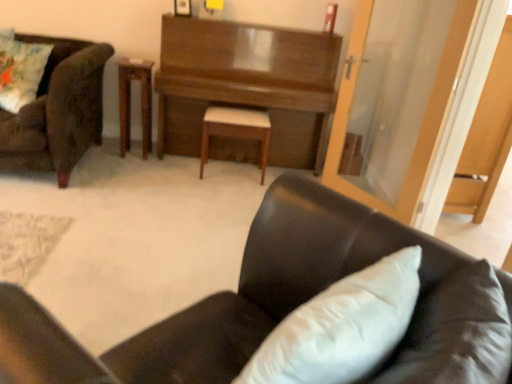
Image resolution: width=512 pixels, height=384 pixels. Describe the element at coordinates (58, 110) in the screenshot. I see `velvet brown armchair at left, the 1th chair viewed from the top` at that location.

I want to click on shiny brown piano at center, so click(247, 84).

Image resolution: width=512 pixels, height=384 pixels. I want to click on white leather stool at center, so click(236, 130).

What do you see at coordinates (130, 101) in the screenshot? Image resolution: width=512 pixels, height=384 pixels. I see `wooden table at center` at bounding box center [130, 101].

This screenshot has height=384, width=512. Describe the element at coordinates (276, 284) in the screenshot. I see `black leather chair at lower right, the second chair in the back-to-front sequence` at that location.

What do you see at coordinates (486, 138) in the screenshot?
I see `transparent glass door at right` at bounding box center [486, 138].

What is the approximate height of transparent glass door at right?

transparent glass door at right is 4.69 feet in height.

Identify the location of velvet brown armchair at left, which is the 1th chair in back-to-front order. (58, 110).

Does white leather stool at center have a greater height compared to shiny brown piano at center?

Incorrect, the height of white leather stool at center is not larger of that of shiny brown piano at center.

Is white leather stool at center looking in the opposite direction of shiny brown piano at center?

Absolutely, white leather stool at center is directed away from shiny brown piano at center.

Is white leather stool at center wider than shiny brown piano at center?

No.

Which object is wider, white leather stool at center or black leather chair at lower right, the second chair when ordered from left to right?

Wider between the two is black leather chair at lower right, the second chair when ordered from left to right.

Is white leather stool at center to the left or to the right of black leather chair at lower right, positioned as the 1th chair in front-to-back order, in the image?

white leather stool at center is positioned on black leather chair at lower right, positioned as the 1th chair in front-to-back order,'s left side.

Considering the points (265, 158) and (42, 363), which point is in front, point (265, 158) or point (42, 363)?

The point (42, 363) is in front.

Is black leather chair at lower right, the 1th chair positioned from the right, at the back of white leather stool at center?

white leather stool at center does not have its back to black leather chair at lower right, the 1th chair positioned from the right.

Looking at this image, is transparent glass door at right smaller than black leather chair at lower right, the 1th chair positioned from the right?

Correct, transparent glass door at right occupies less space than black leather chair at lower right, the 1th chair positioned from the right.

Between point (486, 146) and point (168, 322), which one is positioned behind?

The point (486, 146) is farther.

Which object is thinner, transparent glass door at right or black leather chair at lower right, the second chair viewed from the top?

transparent glass door at right.

From the image's perspective, is transparent glass door at right on top of black leather chair at lower right, the second chair viewed from the top?

Indeed, from the image's perspective, transparent glass door at right is shown above black leather chair at lower right, the second chair viewed from the top.

In the scene shown: Which object is closer to the camera, shiny brown piano at center or white leather stool at center?

shiny brown piano at center is closer to the camera.

Is white leather stool at center a part of shiny brown piano at center?

Indeed, white leather stool at center is located within shiny brown piano at center.

Could you tell me if shiny brown piano at center is facing white leather stool at center?

Yes, shiny brown piano at center is turned towards white leather stool at center.

Looking at this image, is the surface of shiny brown piano at center in direct contact with floral fabric pillow at upper left?

No.

From their relative heights in the image, would you say shiny brown piano at center is taller or shorter than floral fabric pillow at upper left?

shiny brown piano at center is taller than floral fabric pillow at upper left.

Is shiny brown piano at center situated inside floral fabric pillow at upper left or outside?

The correct answer is: outside.

From a real-world perspective, relative to transparent glass door at right, is transparent glass door at upper right vertically above or below?

transparent glass door at upper right is above transparent glass door at right.

What's the angular difference between transparent glass door at upper right and transparent glass door at right's facing directions?

148 degrees.

Consider the image. From the image's perspective, is transparent glass door at upper right beneath transparent glass door at right?

Indeed, from the image's perspective, transparent glass door at upper right is shown beneath transparent glass door at right.

Identify the location of glass door below the transparent glass door at right (from the image's perspective). (422, 120).

Is shiny brown piano at center facing towards transparent glass door at upper right?

Yes, shiny brown piano at center is aimed at transparent glass door at upper right.

From the image's perspective, which one is positioned higher, shiny brown piano at center or transparent glass door at upper right?

From the image's view, shiny brown piano at center is above.

Considering the relative sizes of shiny brown piano at center and transparent glass door at upper right in the image provided, is shiny brown piano at center taller than transparent glass door at upper right?

In fact, shiny brown piano at center may be shorter than transparent glass door at upper right.

From a real-world perspective, is shiny brown piano at center physically located above or below transparent glass door at upper right?

In terms of real-world spatial position, shiny brown piano at center is below transparent glass door at upper right.

In order to click on stool behind the shiny brown piano at center in this screenshot , I will do coord(236,130).

Find the location of `stool lying on the left of black leather chair at lower right, the 1th chair positioned from the right`. stool lying on the left of black leather chair at lower right, the 1th chair positioned from the right is located at coordinates (236, 130).

When comparing their distances from wooden table at center, does black leather chair at lower right, the second chair viewed from the top, or transparent glass door at right seem further?

transparent glass door at right lies further to wooden table at center than the other object.

Based on their spatial positions, is wooden table at center or black leather chair at lower right, the second chair in the back-to-front sequence, further from transparent glass door at upper right?

The object further to transparent glass door at upper right is wooden table at center.

Estimate the real-world distances between objects in this image. Which object is further from floral fabric pillow at upper left, shiny brown piano at center or black leather chair at lower right, the 1th chair positioned from the right?

black leather chair at lower right, the 1th chair positioned from the right, is positioned further to the anchor floral fabric pillow at upper left.

Estimate the real-world distances between objects in this image. Which object is closer to transparent glass door at right, white leather stool at center or shiny brown piano at center?

Based on the image, shiny brown piano at center appears to be nearer to transparent glass door at right.

Based on their spatial positions, is velvet brown armchair at left, the first chair positioned from the left, or black leather chair at lower right, the first chair in the bottom-to-top sequence, closer to transparent glass door at upper right?

black leather chair at lower right, the first chair in the bottom-to-top sequence, lies closer to transparent glass door at upper right than the other object.

From the image, which object appears to be nearer to shiny brown piano at center, white leather stool at center or velvet brown armchair at left, which is the 1th chair in back-to-front order?

Among the two, white leather stool at center is located nearer to shiny brown piano at center.

From the image, which object appears to be nearer to wooden table at center, white leather stool at center or black leather chair at lower right, the 1th chair positioned from the right?

Answer: white leather stool at center.

Based on their spatial positions, is white leather stool at center or wooden table at center closer to floral fabric pillow at upper left?

wooden table at center is positioned closer to the anchor floral fabric pillow at upper left.

Where is `chair situated between floral fabric pillow at upper left and shiny brown piano at center from left to right`? chair situated between floral fabric pillow at upper left and shiny brown piano at center from left to right is located at coordinates (58, 110).

In order to click on chair between black leather chair at lower right, the second chair in the back-to-front sequence, and wooden table at center in the front-back direction in this screenshot , I will do `click(58, 110)`.

This screenshot has height=384, width=512. In order to click on glass door positioned between black leather chair at lower right, the 1th chair positioned from the right, and transparent glass door at right from near to far in this screenshot , I will do `click(422, 120)`.

Find the location of a particular element. table located between floral fabric pillow at upper left and transparent glass door at upper right in the left-right direction is located at coordinates (130, 101).